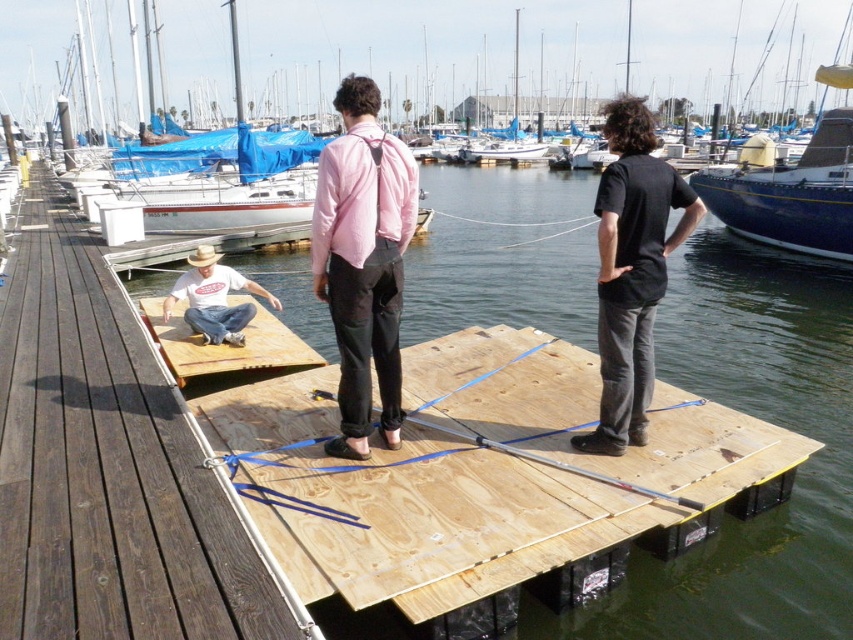
You are planning to walk from the wooden ramp at center to the wooden dock at center. Based on the scene description, which structure is wider and can accommodate more people standing comfortably?

The wooden dock at center is wider than the wooden ramp at center, so it can accommodate more people standing comfortably.

You are standing on the wooden ramp at center and want to move to the wooden dock at center. In which direction should you go?

The wooden dock at center is to the right of wooden ramp at center, so you should go to the right.